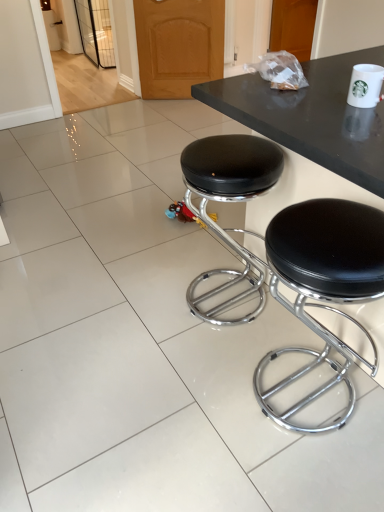
Question: Would you say white ceramic mug at upper right contains black leather stool at center, acting as the second stool starting from the right?

Choices:
 (A) no
 (B) yes

Answer: (A)

Question: From a real-world perspective, is white ceramic mug at upper right over black leather stool at center, acting as the second stool starting from the right?

Choices:
 (A) no
 (B) yes

Answer: (B)

Question: Does white ceramic mug at upper right have a lesser width compared to black leather stool at center, placed as the 1th stool when sorted from left to right?

Choices:
 (A) yes
 (B) no

Answer: (A)

Question: Considering the relative positions of white ceramic mug at upper right and black leather stool at center, acting as the second stool starting from the right, in the image provided, is white ceramic mug at upper right in front of black leather stool at center, acting as the second stool starting from the right,?

Choices:
 (A) no
 (B) yes

Answer: (B)

Question: From the image's perspective, is white ceramic mug at upper right on top of black leather stool at center, placed as the 1th stool when sorted from left to right?

Choices:
 (A) yes
 (B) no

Answer: (A)

Question: Are white ceramic mug at upper right and black leather stool at center, acting as the second stool starting from the right, located far from each other?

Choices:
 (A) yes
 (B) no

Answer: (B)

Question: Does black leather stool at center, positioned as the second stool in left-to-right order, have a greater height compared to white ceramic mug at upper right?

Choices:
 (A) yes
 (B) no

Answer: (A)

Question: From a real-world perspective, is black leather stool at center, which is the first stool from right to left, positioned over white ceramic mug at upper right based on gravity?

Choices:
 (A) no
 (B) yes

Answer: (A)

Question: Is black leather stool at center, which is the first stool from right to left, at the right side of white ceramic mug at upper right?

Choices:
 (A) yes
 (B) no

Answer: (B)

Question: From a real-world perspective, is black leather stool at center, which is the first stool from right to left, beneath white ceramic mug at upper right?

Choices:
 (A) yes
 (B) no

Answer: (A)

Question: Is black leather stool at center, which is the first stool from right to left, at the left side of white ceramic mug at upper right?

Choices:
 (A) yes
 (B) no

Answer: (A)

Question: Is there a large distance between black leather stool at center, positioned as the second stool in left-to-right order, and white ceramic mug at upper right?

Choices:
 (A) yes
 (B) no

Answer: (B)

Question: Is black leather stool at center, placed as the 1th stool when sorted from left to right, oriented towards black leather stool at center, which is the first stool from right to left?

Choices:
 (A) no
 (B) yes

Answer: (A)